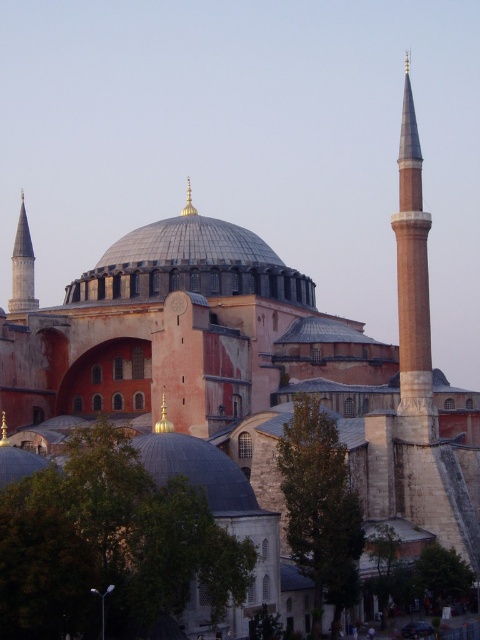
You are an architect analyzing the Hagia Sophia. You need to determine which of the two structures, the smooth stone minaret at left or the gold metallic spire at center, has a larger base width. Based on the description provided, can you conclude which one is wider?

The smooth stone minaret at left might be wider than gold metallic spire at center, so it is possible that the smooth stone minaret at left has a larger base width than the gold metallic spire at center.

You are standing in front of the Hagia Sophia and want to take a photo that includes both the smooth stone minaret at left and the gold metallic spire at center. Which object should you position closer to the left side of your camera frame?

The smooth stone minaret at left is positioned to the left of the gold metallic spire at center, so you should place the smooth stone minaret at left closer to the left side of your camera frame.

You are standing in front of the Hagia Sophia and want to take a photo that includes the smooth stone minaret at left. Where should you position yourself to ensure the minaret is in the frame?

To include the smooth stone minaret at left in your photo, position yourself so that the minaret is within the left side of the frame, as its 2D location is at point [23,266].